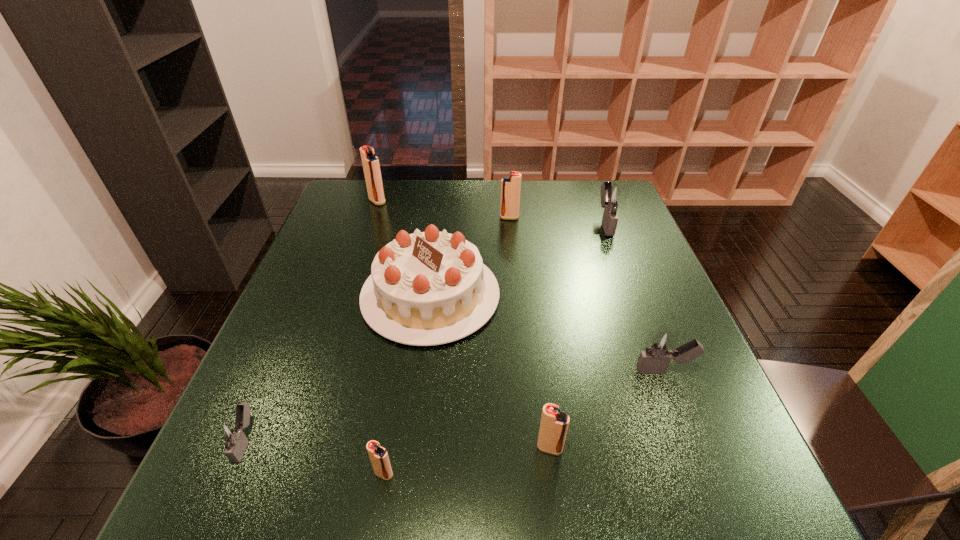
Where is `the farthest object`? Image resolution: width=960 pixels, height=540 pixels. the farthest object is located at coordinates (371, 166).

You are a GUI agent. You are given a task and a screenshot of the screen. Output one action in this format:
    pyautogui.click(x=<x>, y=<y>)
    Task: Click on the tallest object
    This screenshot has width=960, height=540.
    Given the screenshot: What is the action you would take?
    pyautogui.click(x=371, y=166)

I want to click on the third nearest red igniter, so click(510, 185).

Identify the location of the biggest gray igniter. This screenshot has width=960, height=540. (613, 196).

The width and height of the screenshot is (960, 540). Identify the location of the fourth farthest object. (428, 288).

You are a GUI agent. You are given a task and a screenshot of the screen. Output one action in this format:
    pyautogui.click(x=<x>, y=<y>)
    Task: Click on the second nearest gray igniter
    Image resolution: width=960 pixels, height=540 pixels.
    Given the screenshot: What is the action you would take?
    pyautogui.click(x=659, y=349)

The height and width of the screenshot is (540, 960). In order to click on the fourth nearest igniter in this screenshot , I will do `click(659, 349)`.

Locate an element on the screen. Image resolution: width=960 pixels, height=540 pixels. the second smallest red igniter is located at coordinates (554, 424).

The width and height of the screenshot is (960, 540). What are the coordinates of `the nearest igniter` in the screenshot? It's located at (378, 455).

At what (x,y) coordinates should I click in order to perform the action: click on the third igniter from left to right. Please return your answer as a coordinate pair (x, y). The image size is (960, 540). Looking at the image, I should click on (378, 455).